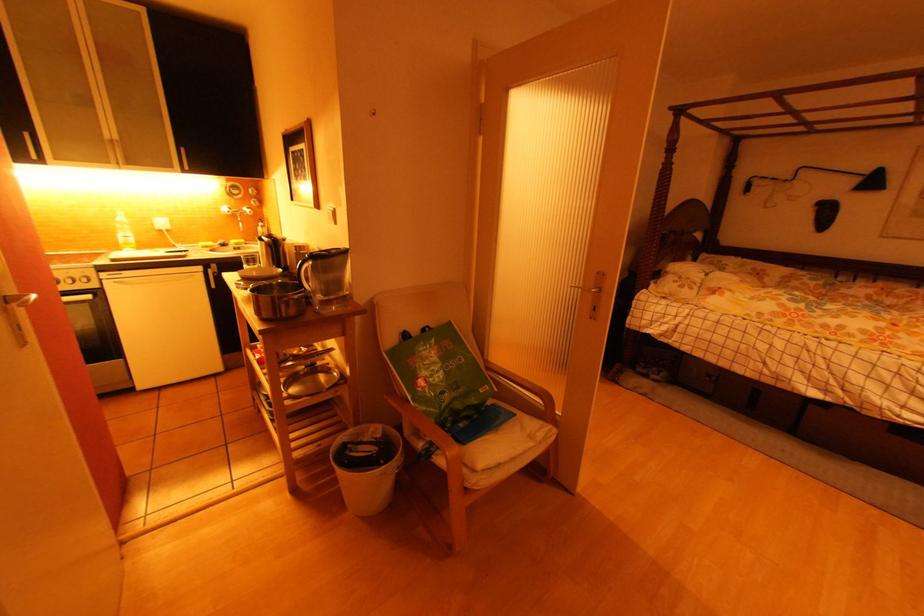
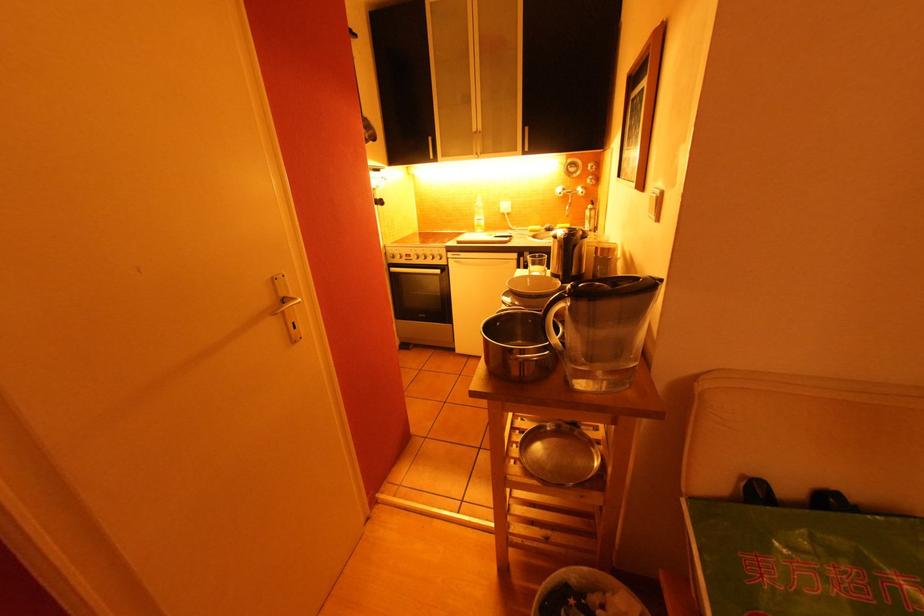
Locate, in the second image, the point that corresponds to (x=286, y=246) in the first image.

(579, 246)